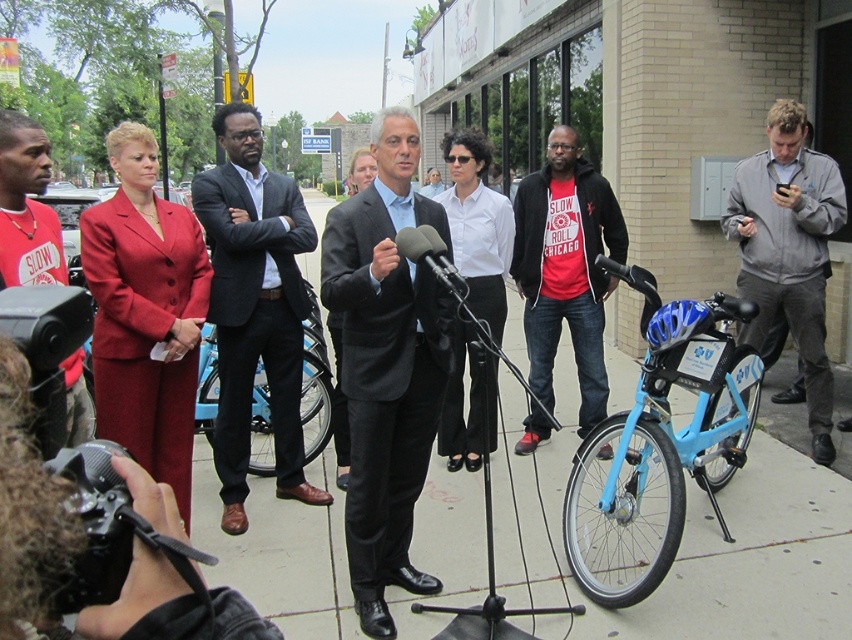
Question: Can you confirm if dark gray suit at center is positioned above dark blue suit at center?

Choices:
 (A) yes
 (B) no

Answer: (B)

Question: Can you confirm if dark gray suit at center is positioned to the right of matte red shirt at left?

Choices:
 (A) yes
 (B) no

Answer: (A)

Question: Can you confirm if dark blue suit at center is bigger than matte red shirt at left?

Choices:
 (A) yes
 (B) no

Answer: (A)

Question: Which object is farther from the camera taking this photo?

Choices:
 (A) dark blue suit at center
 (B) matte black microphone at center
 (C) blue matte bicycle helmet at center
 (D) gray fabric shirt at right

Answer: (D)

Question: Among these objects, which one is farthest from the camera?

Choices:
 (A) blue matte bicycle helmet at center
 (B) dark gray suit at center

Answer: (A)

Question: Which point is farther to the camera?

Choices:
 (A) blue matte bicycle helmet at center
 (B) blue matte bicycle at lower right
 (C) matte red shirt at left

Answer: (A)